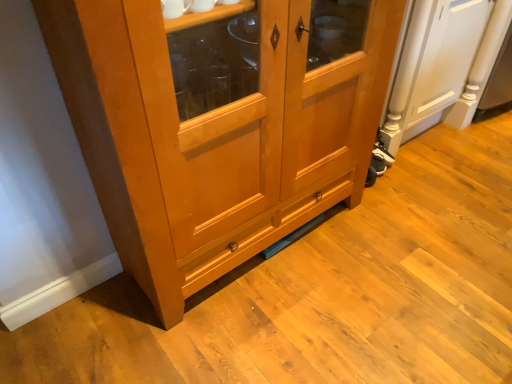
Locate an element on the screen. Image resolution: width=512 pixels, height=384 pixels. vacant region in front of matte wood cupboard at center is located at coordinates (x=268, y=332).